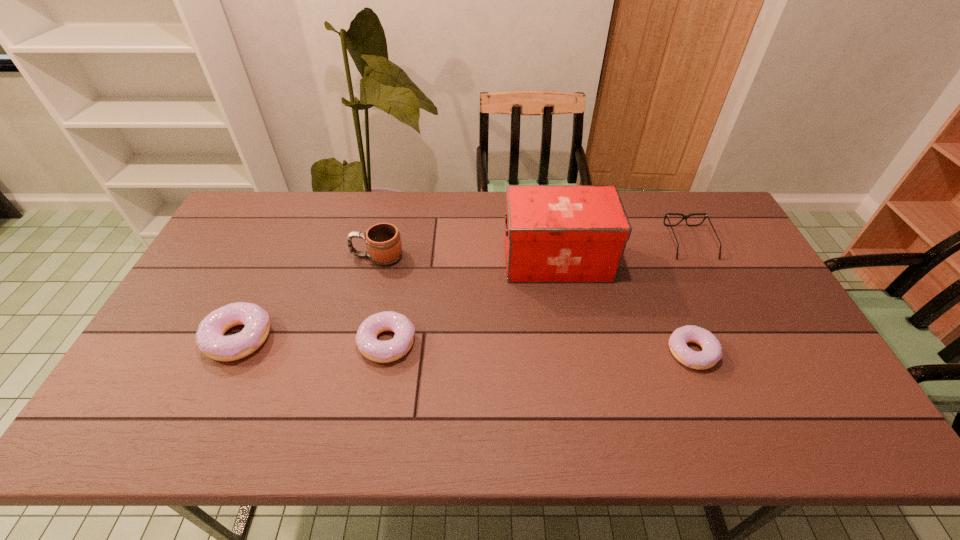
The height and width of the screenshot is (540, 960). I want to click on free location that satisfies the following two spatial constraints: 1. on the back side of the second doughnut from left to right; 2. on the side of the second tallest object with the handle, so click(x=402, y=256).

Locate an element on the screen. Image resolution: width=960 pixels, height=540 pixels. vacant space that satisfies the following two spatial constraints: 1. on the handle side of the tallest object; 2. on the left side of the shortest object is located at coordinates (573, 353).

Where is `vacant point that satisfies the following two spatial constraints: 1. on the front side of the shortest doughnut; 2. on the right side of the second shortest doughnut`? The height and width of the screenshot is (540, 960). vacant point that satisfies the following two spatial constraints: 1. on the front side of the shortest doughnut; 2. on the right side of the second shortest doughnut is located at coordinates (385, 353).

Where is `vacant space that satisfies the following two spatial constraints: 1. with the lenses facing outward on the spectacles; 2. on the handle side of the first-aid kit`? This screenshot has width=960, height=540. vacant space that satisfies the following two spatial constraints: 1. with the lenses facing outward on the spectacles; 2. on the handle side of the first-aid kit is located at coordinates (698, 260).